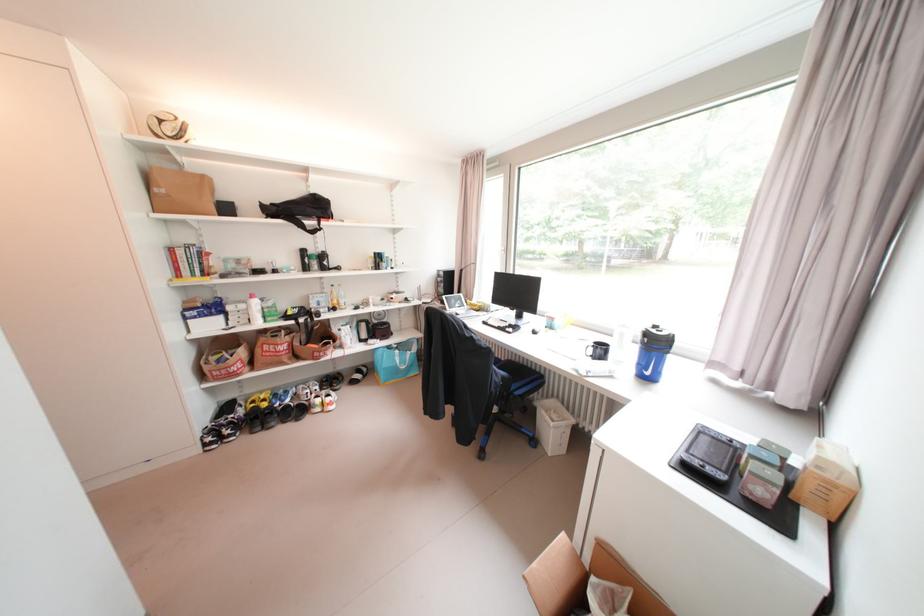
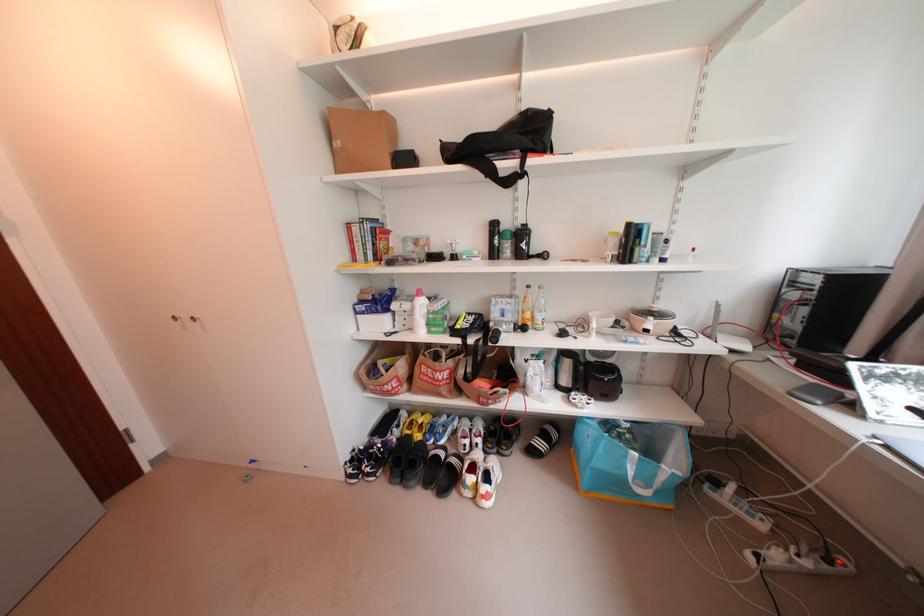
In the second image, find the point that corresponds to (x=399, y=300) in the first image.

(655, 331)